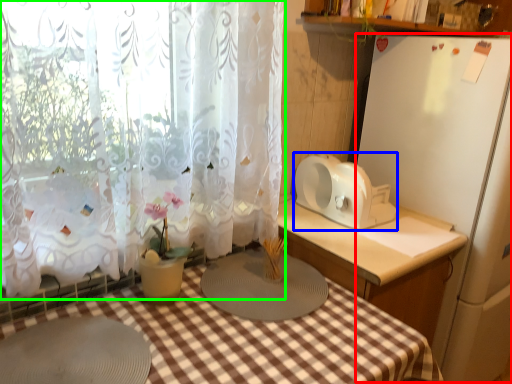
Question: Which object is positioned closest to appliance (highlighted by a red box)? Select from appliance (highlighted by a blue box) and curtain (highlighted by a green box).

Choices:
 (A) appliance
 (B) curtain

Answer: (A)